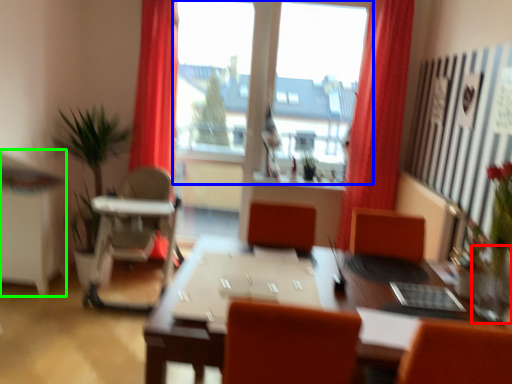
Question: Which object is positioned farthest from glass vase (highlighted by a red box)? Select from window (highlighted by a blue box) and computer desk (highlighted by a green box).

Choices:
 (A) window
 (B) computer desk

Answer: (A)